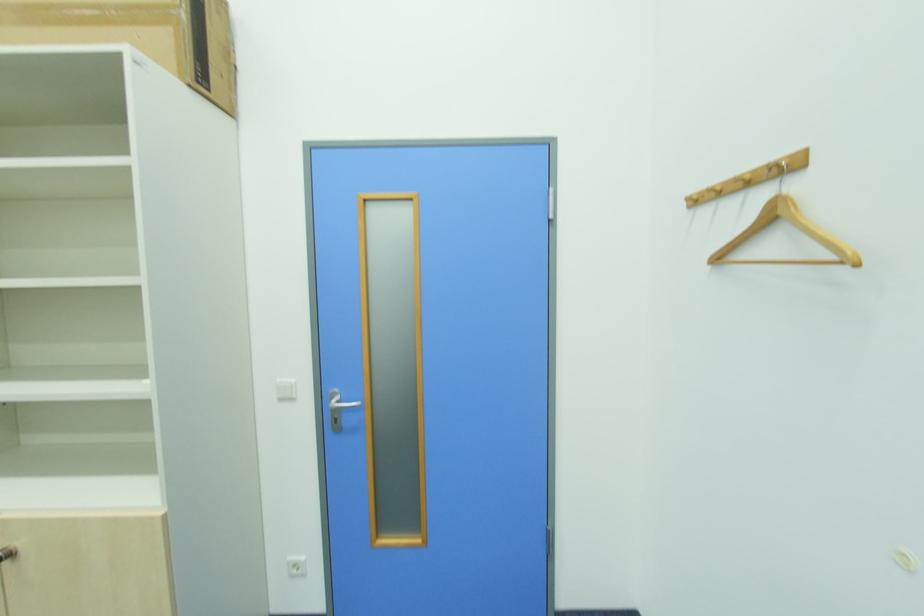
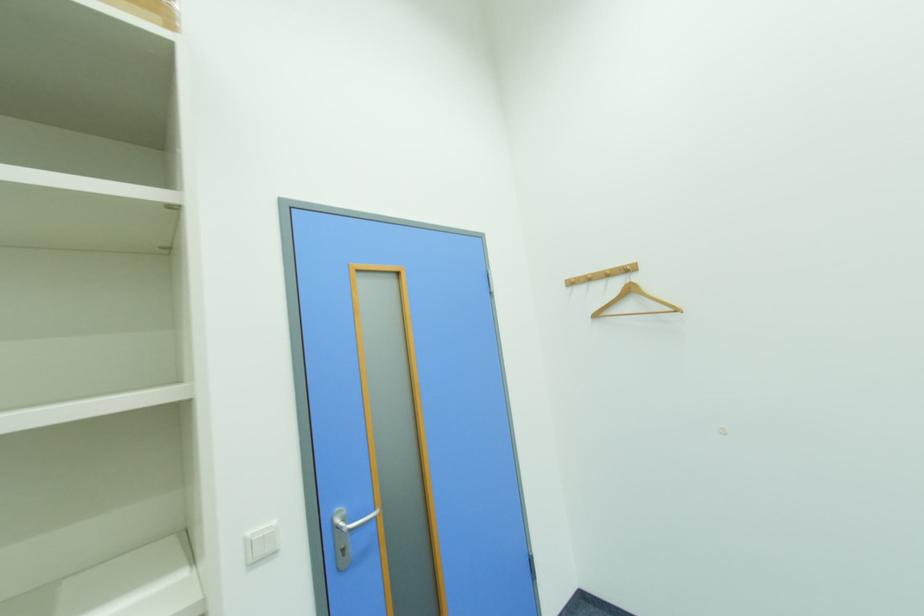
In the second image, find the point that corresponds to (722,262) in the first image.

(601, 317)